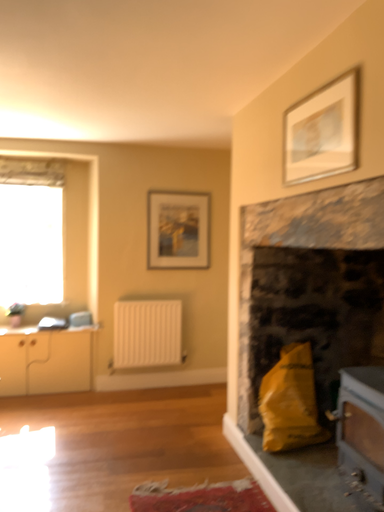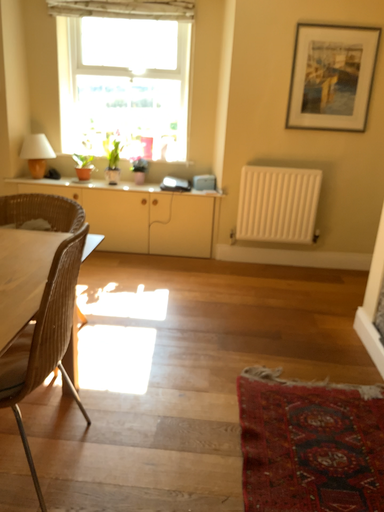
Question: How did the camera likely rotate when shooting the video?

Choices:
 (A) rotated upward
 (B) rotated downward

Answer: (B)